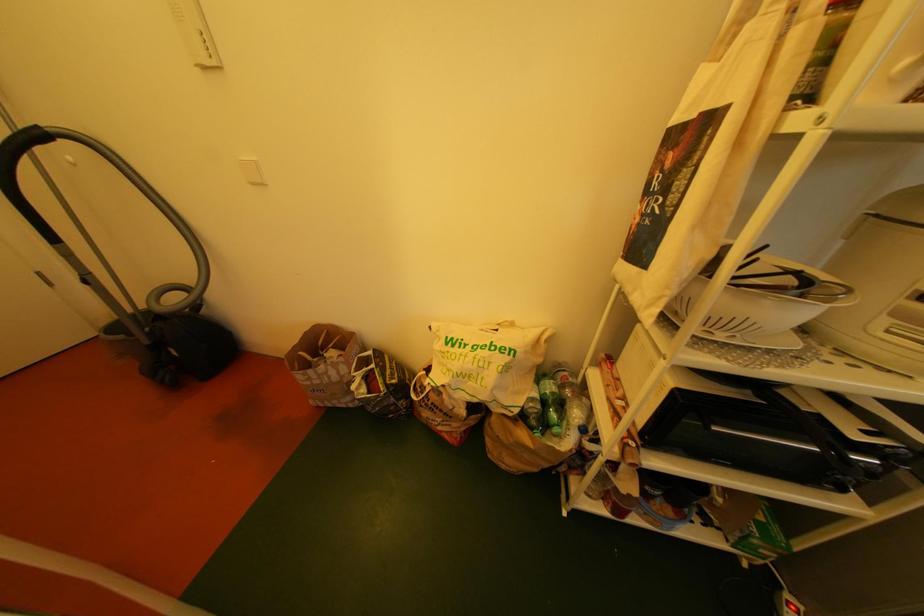
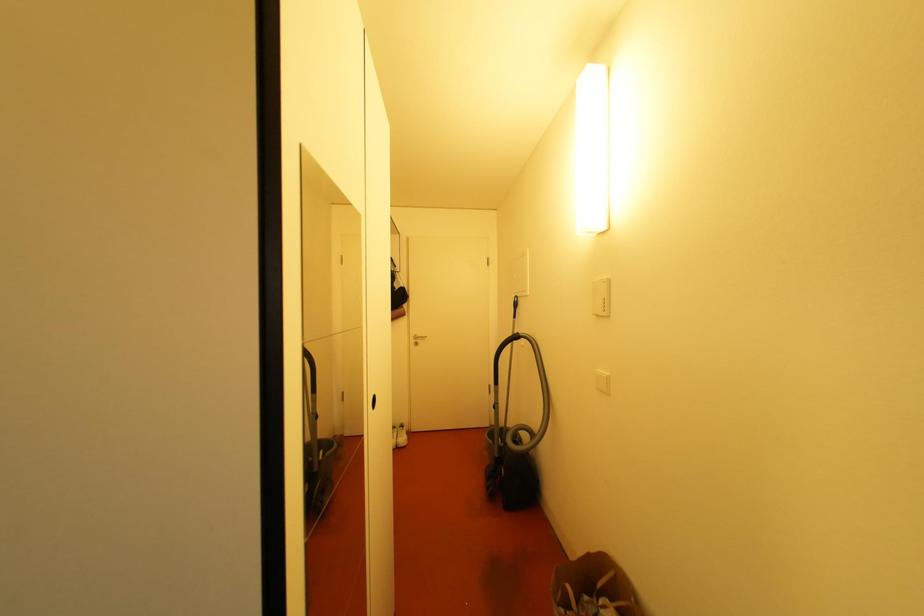
Question: The first image is from the beginning of the video and the second image is from the end. How did the camera likely rotate when shooting the video?

Choices:
 (A) Left
 (B) Right
 (C) Up
 (D) Down

Answer: (A)